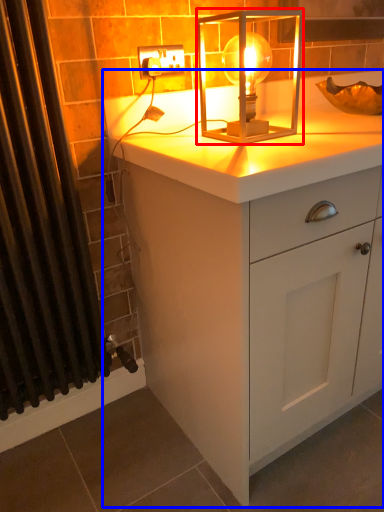
Question: Which of the following is the farthest to the observer, lamp (highlighted by a red box) or chest of drawers (highlighted by a blue box)?

Choices:
 (A) lamp
 (B) chest of drawers

Answer: (A)